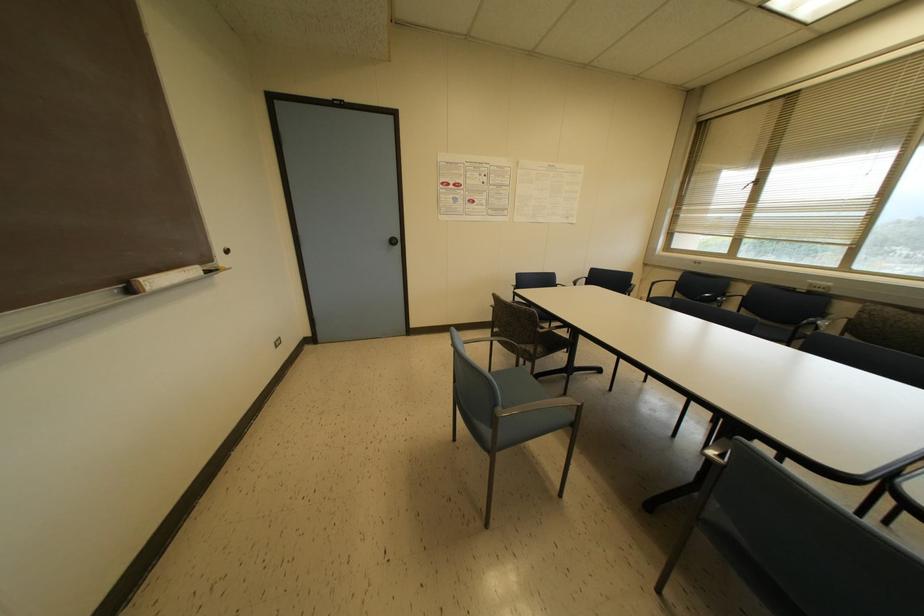
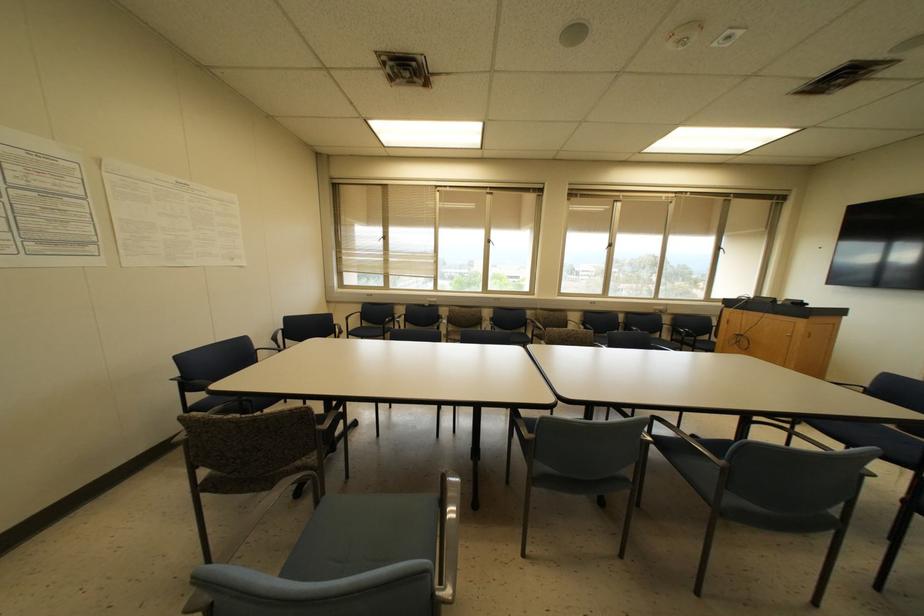
Find the pixel in the second image that matches (x=494, y=405) in the first image.

(432, 594)